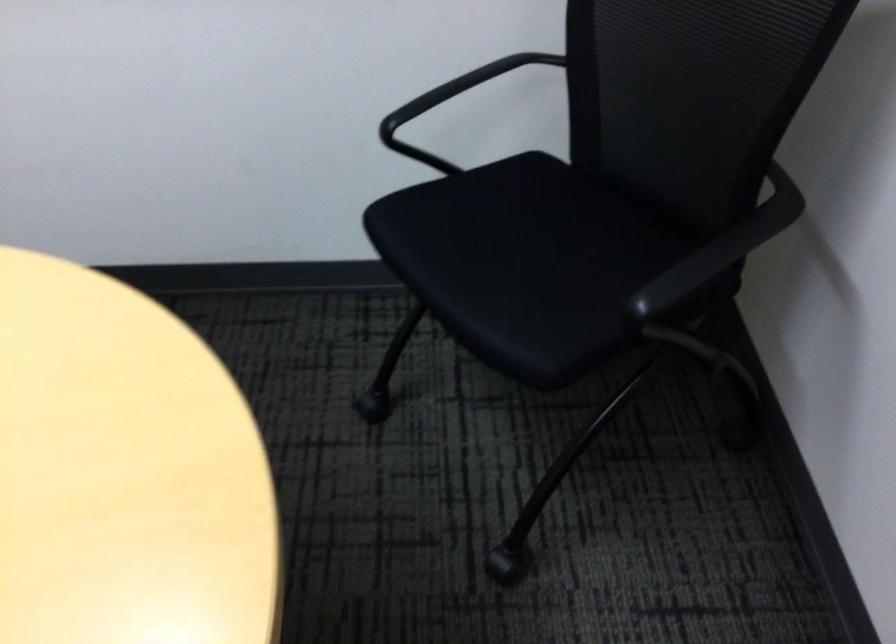
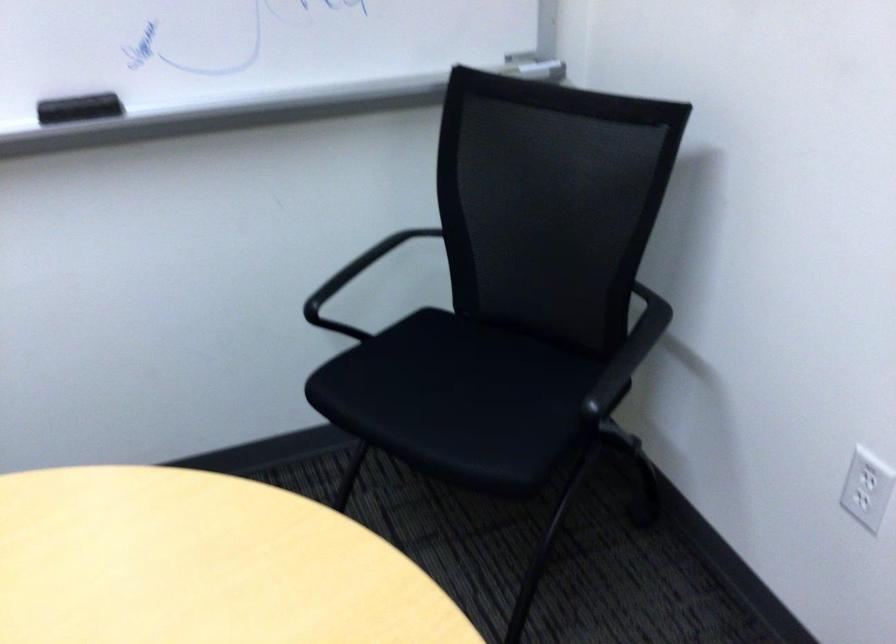
Locate, in the second image, the point that corresponds to [461,120] in the first image.

(341, 290)